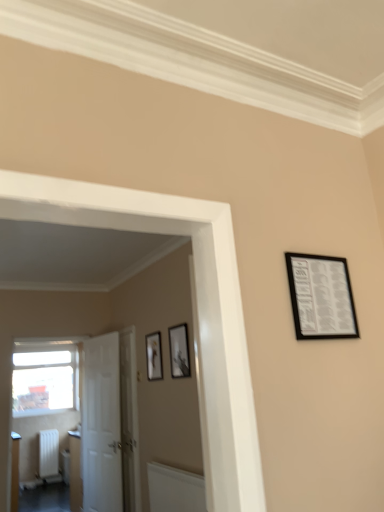
Question: Looking at their shapes, would you say matte black picture frame at center, the third picture frame viewed from the front, is wider or thinner than transparent glass window at left?

Choices:
 (A) wide
 (B) thin

Answer: (B)

Question: From the image's perspective, is matte black picture frame at center, the third picture frame when ordered from top to bottom, located above or below transparent glass window at left?

Choices:
 (A) above
 (B) below

Answer: (A)

Question: Estimate the real-world distances between objects in this image. Which object is closer to the white matte radiator at lower left?

Choices:
 (A) matte black picture frame at center, the 2th picture frame in the bottom-to-top sequence
 (B) black matte picture frame at upper right, which is the first picture frame from front to back
 (C) matte black picture frame at center, the third picture frame when ordered from top to bottom
 (D) white glossy door at center, arranged as the second door when viewed from the left
 (E) matte white radiator at lower left

Answer: (E)

Question: Considering the real-world distances, which object is farthest from the transparent glass window at left?

Choices:
 (A) matte black picture frame at center, the third picture frame when ordered from top to bottom
 (B) white matte radiator at lower left
 (C) white matte door at left, marked as the first door in a left-to-right arrangement
 (D) matte white radiator at lower left
 (E) black matte picture frame at upper right, which is the first picture frame from front to back

Answer: (E)